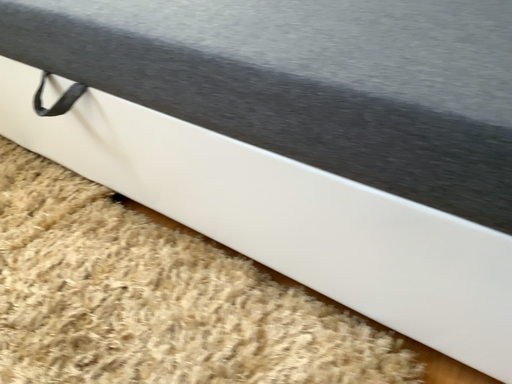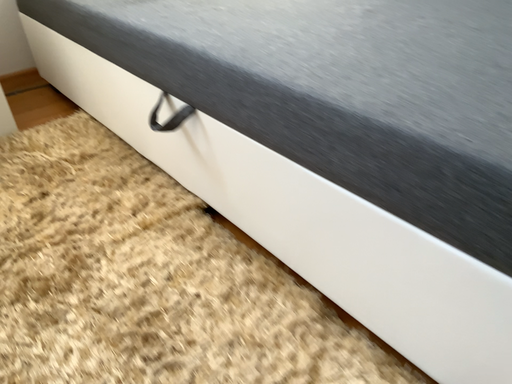
Question: How did the camera likely rotate when shooting the video?

Choices:
 (A) rotated left
 (B) rotated right

Answer: (A)